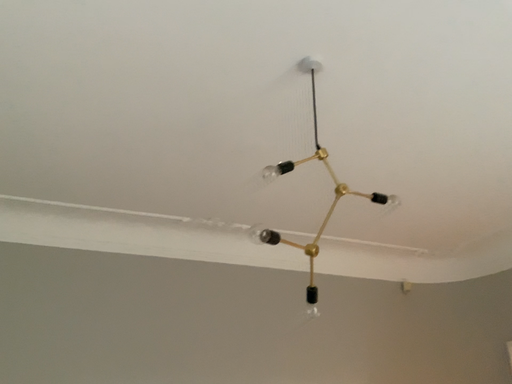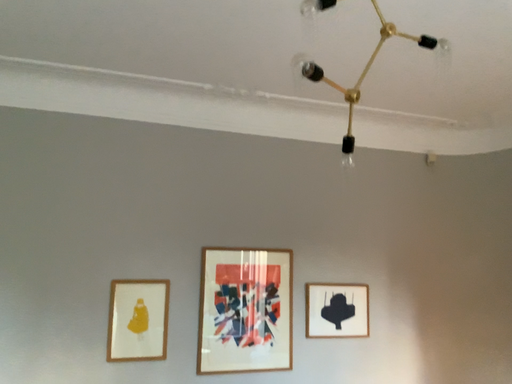
Question: Which way did the camera rotate in the video?

Choices:
 (A) rotated downward
 (B) rotated upward

Answer: (A)